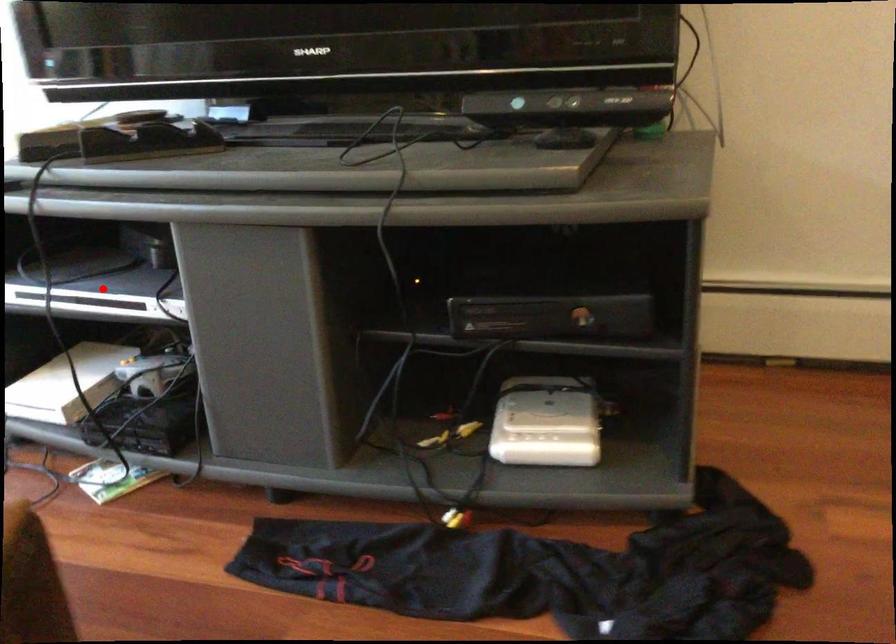
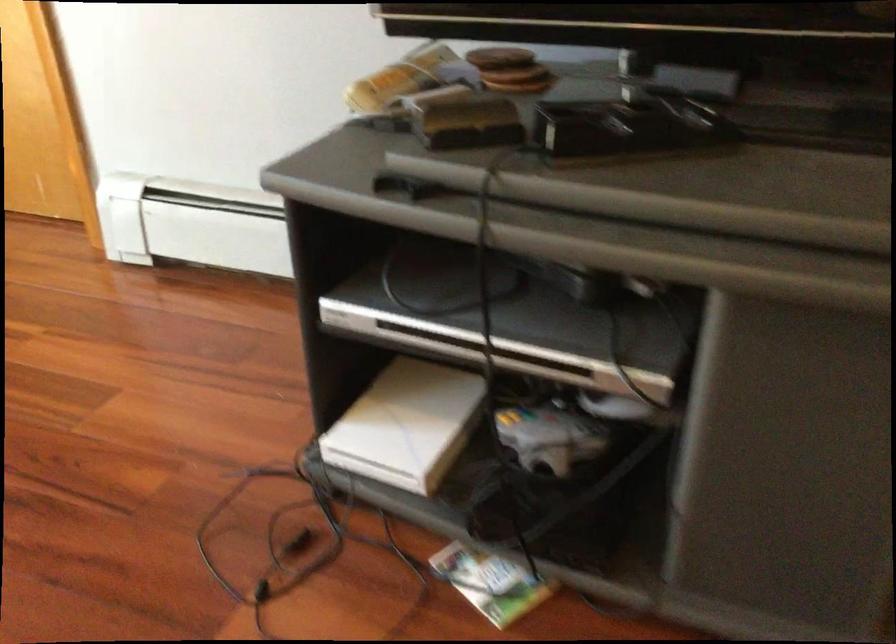
Locate, in the second image, the point that corresponds to the highlighted location in the first image.

(505, 321)